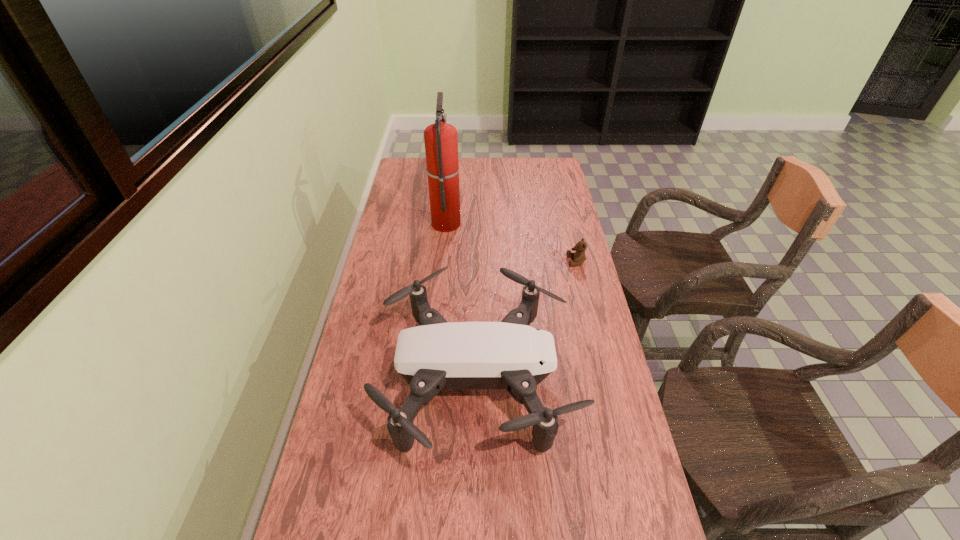
I want to click on the farthest object, so click(x=441, y=139).

Where is `fire extinguisher`? fire extinguisher is located at coordinates (441, 139).

Locate an element on the screen. This screenshot has height=540, width=960. the second shortest object is located at coordinates (511, 355).

This screenshot has height=540, width=960. Find the location of `drone`. drone is located at coordinates (511, 355).

This screenshot has width=960, height=540. In order to click on the rightmost object in this screenshot , I will do `click(579, 257)`.

Locate an element on the screen. The width and height of the screenshot is (960, 540). the shortest object is located at coordinates (579, 257).

At what (x,y) coordinates should I click in order to perform the action: click on free point located 0.160m with the nozzle and gauge on the farthest object. Please return your answer as a coordinate pair (x, y). The image size is (960, 540). Looking at the image, I should click on tap(501, 222).

I want to click on blank space located 0.060m on the camera side of the drone, so click(594, 379).

Where is `vacant area situated on the front-facing side of the second nearest object`? This screenshot has width=960, height=540. vacant area situated on the front-facing side of the second nearest object is located at coordinates (478, 261).

Identify the location of vacant region located on the front-facing side of the second nearest object. This screenshot has height=540, width=960. (534, 261).